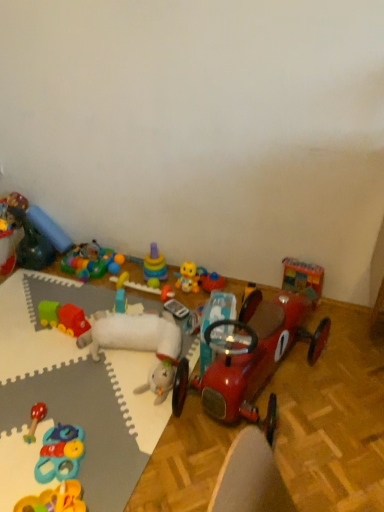
Where is `blank area to the left of rubber green and red train at lower left, marked as the 4th toy in a left-to-right arrangement`? The width and height of the screenshot is (384, 512). blank area to the left of rubber green and red train at lower left, marked as the 4th toy in a left-to-right arrangement is located at coordinates (22, 329).